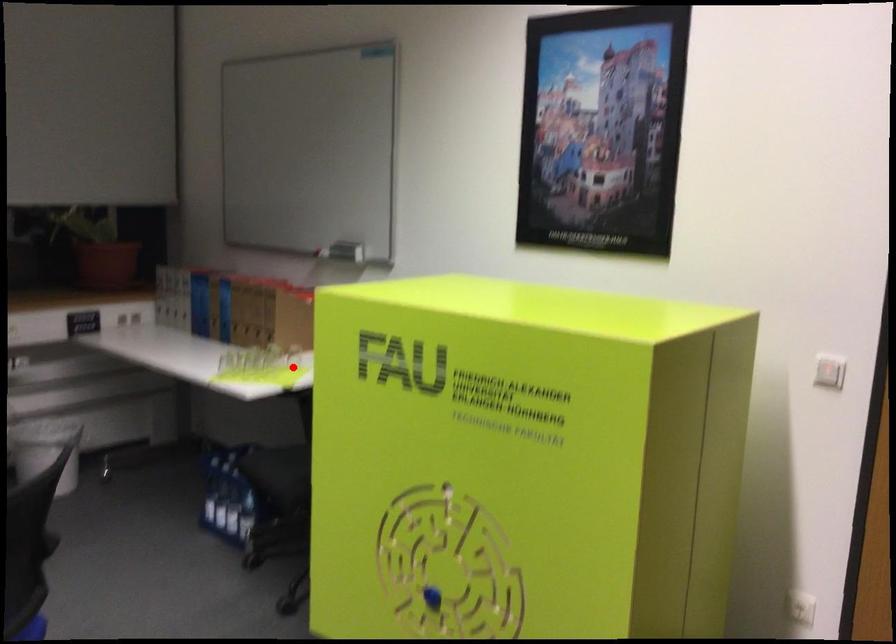
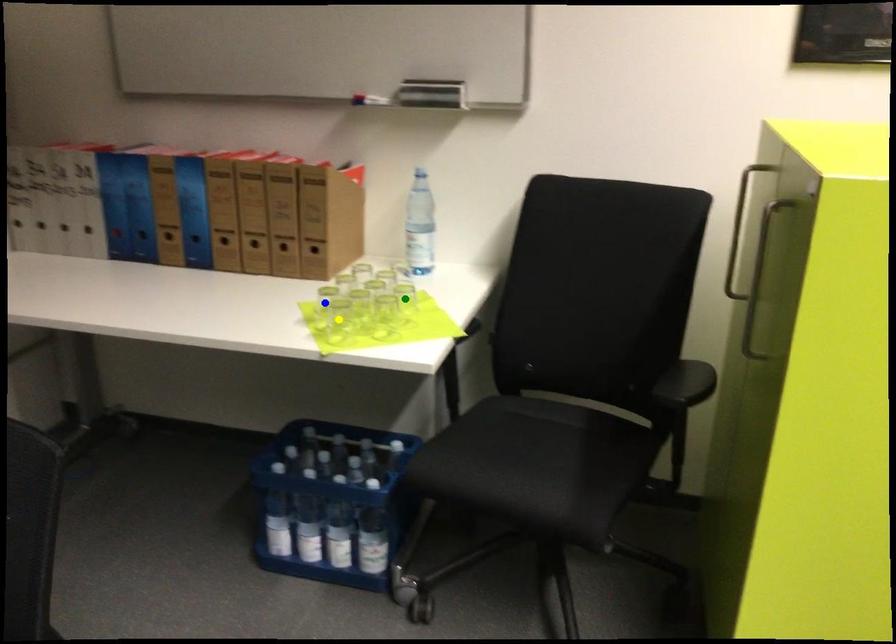
Question: I am providing you with two images of the same scene from different viewpoints. A red point is marked on the first image. You are given multiple points on the second image. Which point in image 2 is actually the same real-world point as the red point in image 1?

Choices:
 (A) yellow point
 (B) green point
 (C) blue point

Answer: (B)